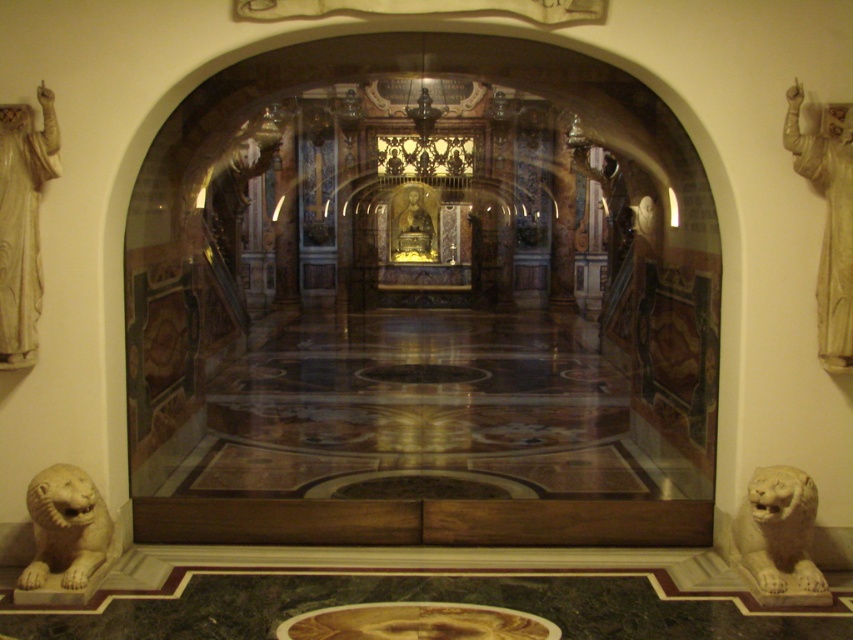
Does white marble lion at lower right appear on the right side of white marble lion at lower left?

Yes, white marble lion at lower right is to the right of white marble lion at lower left.

Is white marble lion at lower right closer to the viewer compared to white marble lion at lower left?

That is False.

Between point (815, 570) and point (96, 513), which one is positioned behind?

Positioned behind is point (96, 513).

Where is `white marble lion at lower right`? This screenshot has width=853, height=640. white marble lion at lower right is located at coordinates (778, 532).

Which is behind, point (757, 525) or point (434, 208)?

Point (434, 208)

Who is lower down, white marble lion at lower right or gold polished statue at center?

white marble lion at lower right is below.

What do you see at coordinates (778, 532) in the screenshot? The height and width of the screenshot is (640, 853). I see `white marble lion at lower right` at bounding box center [778, 532].

The height and width of the screenshot is (640, 853). What are the coordinates of `white marble lion at lower right` in the screenshot? It's located at (778, 532).

Is point (840, 369) farther from viewer compared to point (421, 211)?

No, it is not.

Image resolution: width=853 pixels, height=640 pixels. What are the coordinates of `white marble statue at upper right` in the screenshot? It's located at (828, 220).